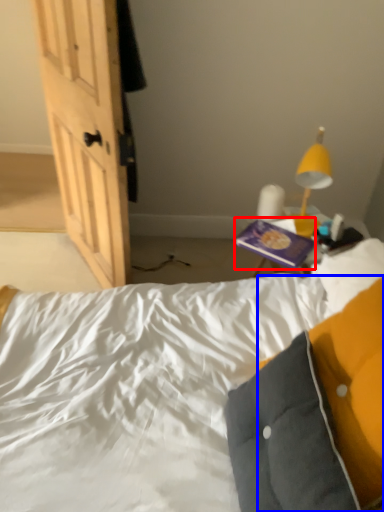
Question: Which object is closer to the camera taking this photo, paperback book (highlighted by a red box) or pillow (highlighted by a blue box)?

Choices:
 (A) paperback book
 (B) pillow

Answer: (B)